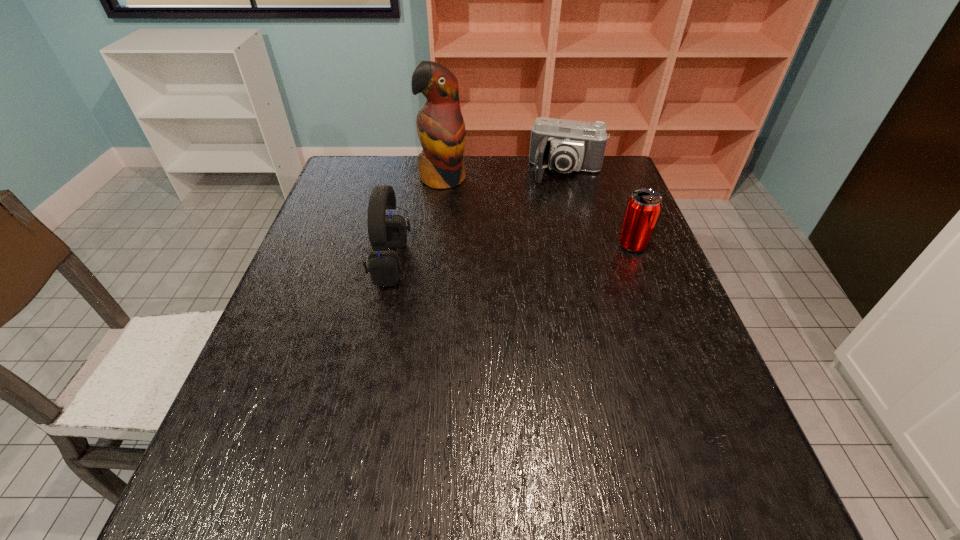
At what (x,y) coordinates should I click in order to perform the action: click on vacant region at the left edge of the desktop. Please return your answer as a coordinate pair (x, y). This screenshot has height=540, width=960. Looking at the image, I should click on (317, 312).

At what (x,y) coordinates should I click in order to perform the action: click on vacant area at the right edge of the desktop. Please return your answer as a coordinate pair (x, y). The height and width of the screenshot is (540, 960). Looking at the image, I should click on (608, 237).

Where is `vacant region at the far left corner of the desktop`? The height and width of the screenshot is (540, 960). vacant region at the far left corner of the desktop is located at coordinates (342, 195).

Find the location of `vacant area at the near left corner of the desktop`. vacant area at the near left corner of the desktop is located at coordinates (297, 446).

The width and height of the screenshot is (960, 540). In order to click on free space at the far right corner of the desktop in this screenshot , I will do `click(588, 173)`.

In the image, there is a desktop. Where is `free space at the near right corner`? free space at the near right corner is located at coordinates (692, 451).

Find the location of a particular element. The image size is (960, 540). unoccupied area between the tallest object and the camera is located at coordinates (505, 176).

Locate an element on the screen. The image size is (960, 540). free area in between the camera and the soda can is located at coordinates (599, 208).

Image resolution: width=960 pixels, height=540 pixels. I want to click on vacant area that lies between the camera and the tallest object, so click(x=505, y=176).

Image resolution: width=960 pixels, height=540 pixels. What are the coordinates of `free point between the camera and the soda can` in the screenshot? It's located at (599, 208).